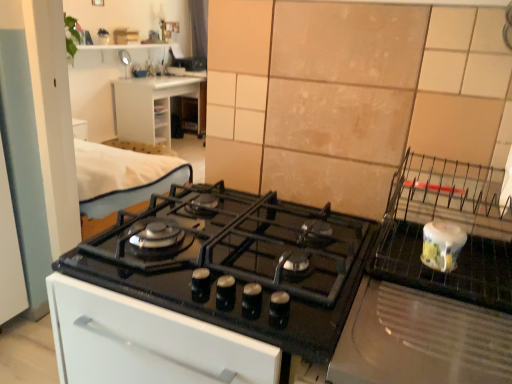
Question: Is white ceramic jar at right in front of or behind beige tile at upper right in the image?

Choices:
 (A) behind
 (B) front

Answer: (B)

Question: From the image's perspective, is white ceramic jar at right positioned above or below beige tile at upper right?

Choices:
 (A) above
 (B) below

Answer: (B)

Question: Estimate the real-world distances between objects in this image. Which object is closer to the porcelain yellow jar at right?

Choices:
 (A) white plastic drawer at upper left
 (B) beige tile at upper right
 (C) black glass gas stove at center
 (D) white ceramic jar at right

Answer: (D)

Question: Which of these objects is positioned closest to the black glass gas stove at center?

Choices:
 (A) porcelain yellow jar at right
 (B) beige tile at upper right
 (C) white ceramic jar at right
 (D) white plastic drawer at upper left

Answer: (C)